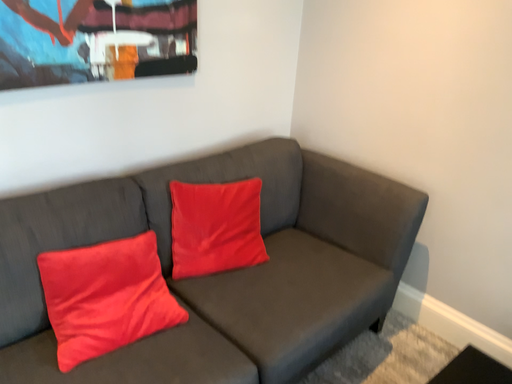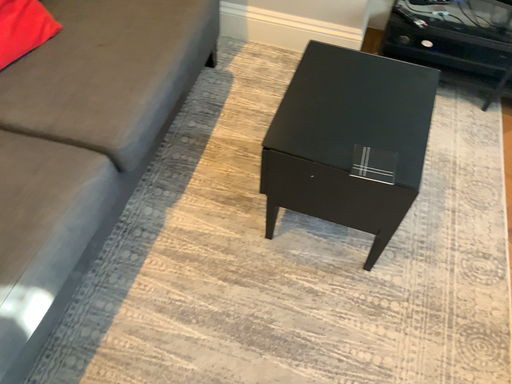
Question: How did the camera likely rotate when shooting the video?

Choices:
 (A) rotated downward
 (B) rotated upward

Answer: (A)